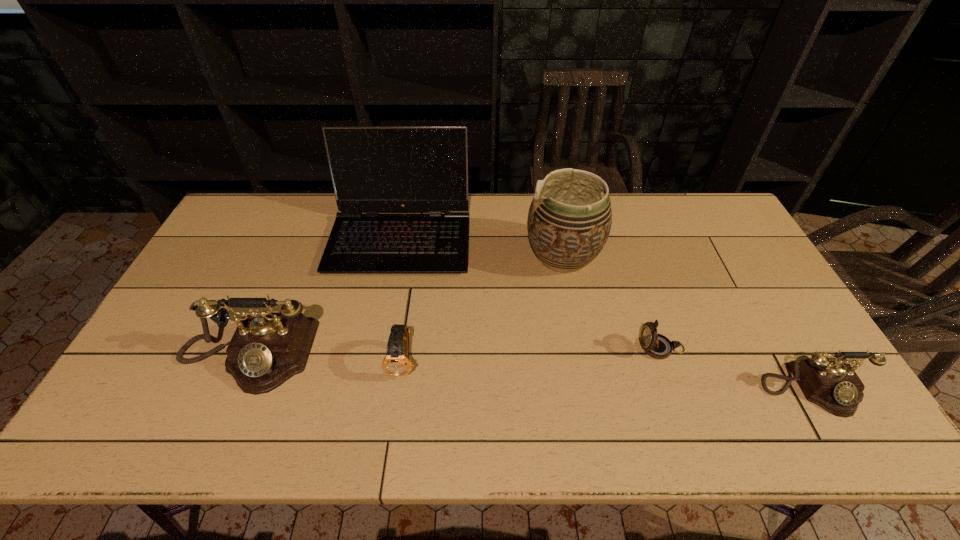
If equal spacing is desired by inserting an extra telephone among them, please point out a free spot for this new telephone. Please provide its 2D coordinates. Your answer should be formatted as a tuple, i.e. [(x, y)], where the tuple contains the x and y coordinates of a point satisfying the conditions above.

[(521, 372)]